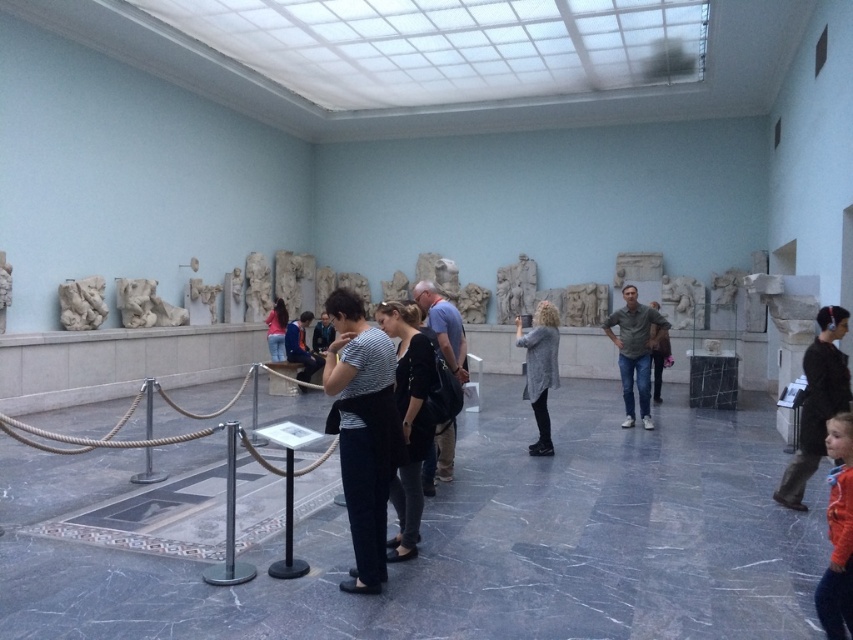
You are a security guard in the museum. You need to locate the blue cotton shirt at center. Where exactly is it positioned in the room?

The blue cotton shirt at center is positioned at coordinates point (444, 326) in the room.

You are a security guard in the museum and need to ensure that visitors are maintaining a safe distance of at least 18 inches from the ancient stone sculptures. You notice two visitors wearing a striped fabric shirt at center and a black fabric dress at center. Are they currently violating the safety distance rule?

The distance between the striped fabric shirt at center and the black fabric dress at center is 15.35 inches, which is less than the required 18 inches. Therefore, they are violating the safety distance rule and should move further apart to comply with the museum guidelines.